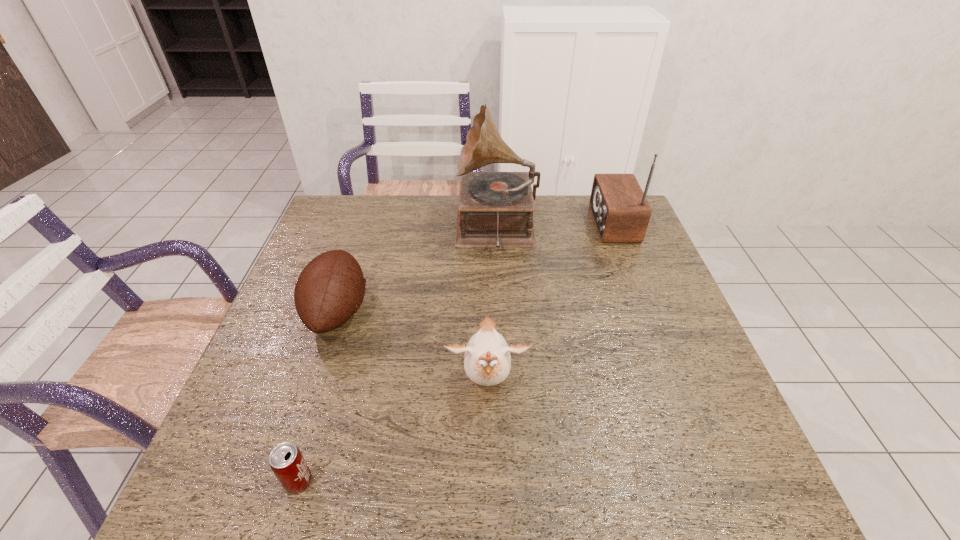
The width and height of the screenshot is (960, 540). I want to click on free space that satisfies the following two spatial constraints: 1. from the horn of the tallest object; 2. at the beak of the bird, so click(x=504, y=382).

The image size is (960, 540). I want to click on free location that satisfies the following two spatial constraints: 1. on the laces of the shortest object; 2. on the right side of the football, so click(282, 481).